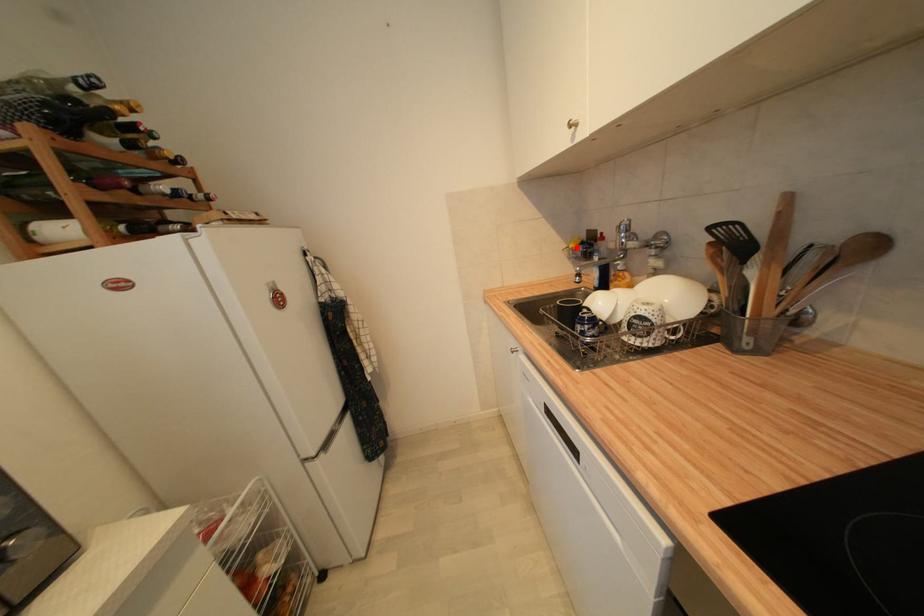
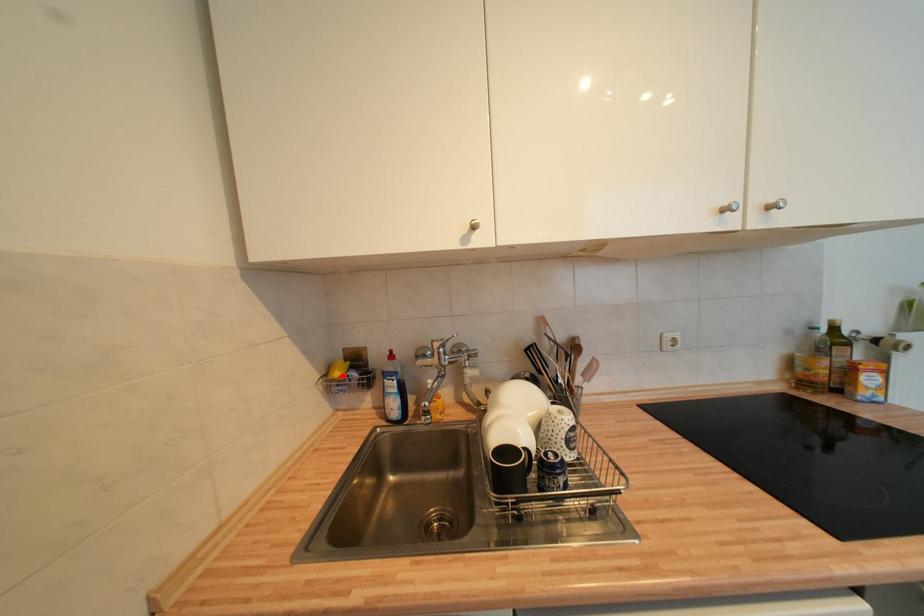
I am providing you with two images of the same scene from different viewpoints. A red point is marked on the first image and another point is marked on the second image. Is the red point in image1 aligned with the point shown in image2?

→ Yes